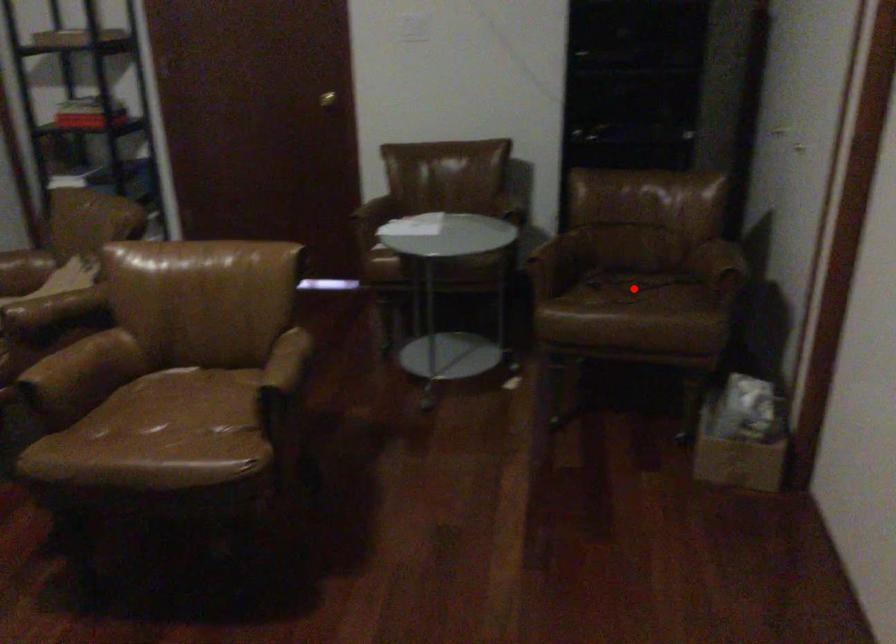
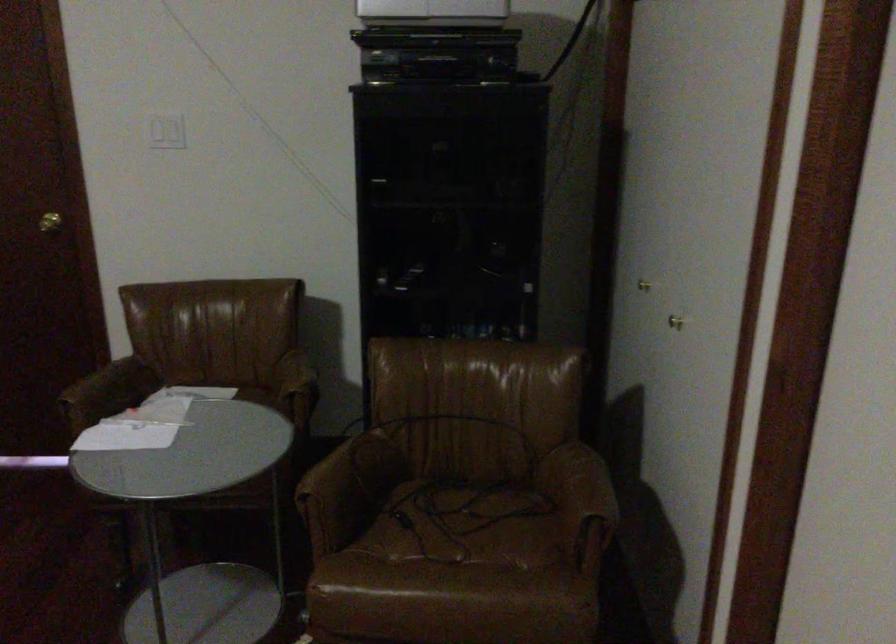
Question: A red point is marked in image1. In image2, is the corresponding 3D point closer to the camera or farther? Reply with the corresponding letter.

Choices:
 (A) The corresponding 3D point is closer.
 (B) The corresponding 3D point is farther.

Answer: (A)